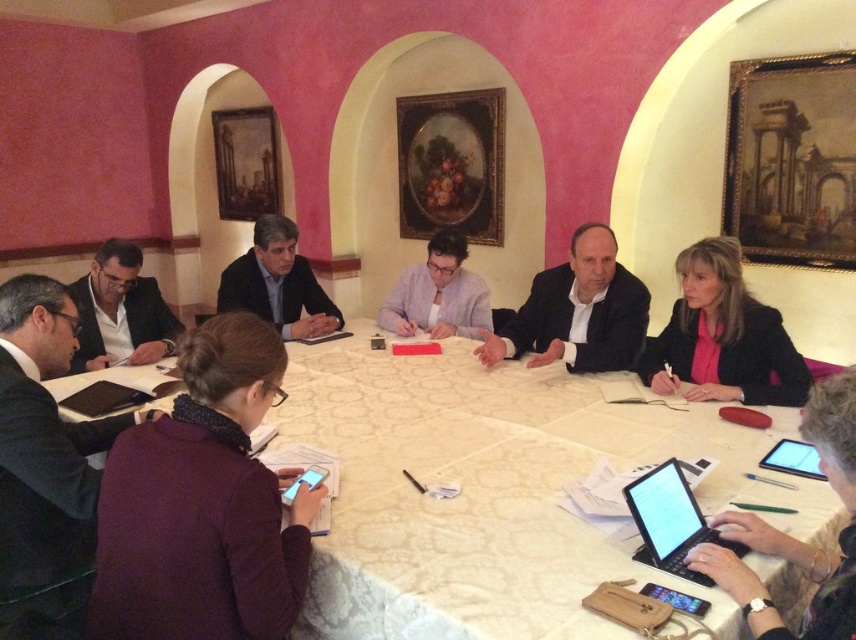
Question: Which of the following is the farthest from the observer?

Choices:
 (A) matte black suit at left
 (B) light purple sweater at center
 (C) black suit at lower left
 (D) white glossy table at center

Answer: (B)

Question: Estimate the real-world distances between objects in this image. Which object is farther from the white glossy table at center?

Choices:
 (A) white shirt at center
 (B) purple sweater at lower left

Answer: (B)

Question: Is white glossy table at center above black plastic laptop at lower right?

Choices:
 (A) yes
 (B) no

Answer: (A)

Question: From the image, what is the correct spatial relationship of pink matte blazer at lower right in relation to dark gray suit at center?

Choices:
 (A) above
 (B) below

Answer: (B)

Question: Is white glossy table at center positioned before matte black suit at left?

Choices:
 (A) no
 (B) yes

Answer: (B)

Question: Based on their relative distances, which object is nearer to the black matte laptop at lower right?

Choices:
 (A) white shirt at center
 (B) dark gray suit at center
 (C) black plastic laptop at lower right
 (D) matte black suit at left

Answer: (C)